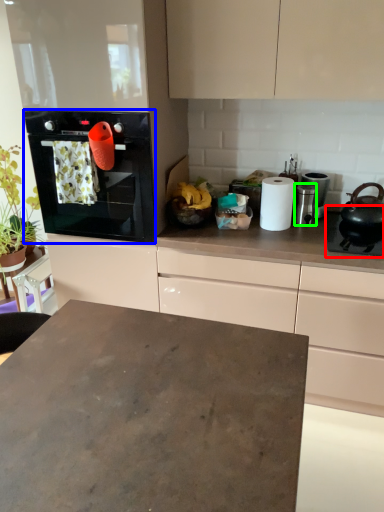
Question: Which object is the closest to the gas stove (highlighted by a red box)? Choose among these: home appliance (highlighted by a blue box) or appliance (highlighted by a green box).

Choices:
 (A) home appliance
 (B) appliance

Answer: (B)